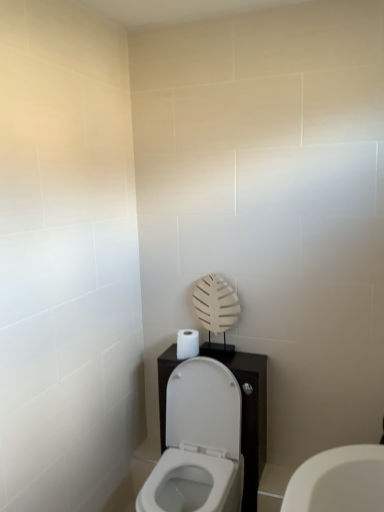
Question: From a real-world perspective, is white glossy toilet at center located higher than white matte toilet paper at center?

Choices:
 (A) yes
 (B) no

Answer: (B)

Question: Is white glossy toilet at center taller than white matte toilet paper at center?

Choices:
 (A) yes
 (B) no

Answer: (A)

Question: Is white glossy toilet at center beside white matte toilet paper at center?

Choices:
 (A) yes
 (B) no

Answer: (B)

Question: From the image's perspective, would you say white glossy toilet at center is positioned over white matte toilet paper at center?

Choices:
 (A) yes
 (B) no

Answer: (B)

Question: Does white glossy toilet at center have a larger size compared to white matte toilet paper at center?

Choices:
 (A) yes
 (B) no

Answer: (A)

Question: Can you confirm if white glossy toilet at center is thinner than white matte toilet paper at center?

Choices:
 (A) no
 (B) yes

Answer: (A)

Question: Is white matte toilet paper at center to the right of white glossy toilet at center from the viewer's perspective?

Choices:
 (A) no
 (B) yes

Answer: (A)

Question: Considering the relative sizes of white matte toilet paper at center and white glossy toilet at center in the image provided, is white matte toilet paper at center bigger than white glossy toilet at center?

Choices:
 (A) yes
 (B) no

Answer: (B)

Question: From a real-world perspective, is white matte toilet paper at center on white glossy toilet at center?

Choices:
 (A) yes
 (B) no

Answer: (A)

Question: Could white glossy toilet at center be considered to be inside white matte toilet paper at center?

Choices:
 (A) yes
 (B) no

Answer: (B)

Question: Considering the relative sizes of white matte toilet paper at center and white glossy toilet at center in the image provided, is white matte toilet paper at center wider than white glossy toilet at center?

Choices:
 (A) yes
 (B) no

Answer: (B)

Question: Does white matte toilet paper at center turn towards white glossy toilet at center?

Choices:
 (A) yes
 (B) no

Answer: (B)

Question: Looking at their shapes, would you say white matte toilet paper at center is wider or thinner than white glossy toilet at center?

Choices:
 (A) wide
 (B) thin

Answer: (B)